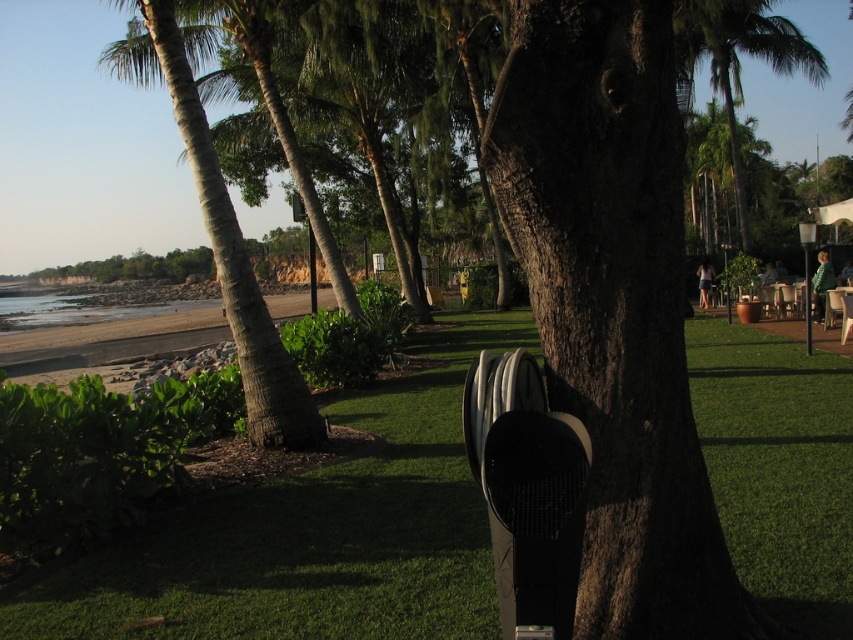
Who is more forward, (828,371) or (733,28)?

Point (828,371)

Does green grass at center appear on the left side of green leafy palm tree at upper right?

Yes, green grass at center is to the left of green leafy palm tree at upper right.

Is point (733, 422) closer to viewer compared to point (776, 70)?

Yes, it is in front of point (776, 70).

I want to click on green grass at center, so click(x=312, y=534).

Which is more to the left, green grass at center or green leafy palm tree at upper center?

green grass at center

Is green grass at center behind green leafy palm tree at upper center?

No.

Which is behind, point (389, 515) or point (734, 168)?

Point (734, 168)

I want to click on green grass at center, so click(x=312, y=534).

Consider the image. Can you confirm if white plastic beach chair at center is taller than green leafy palm tree at upper center?

In fact, white plastic beach chair at center may be shorter than green leafy palm tree at upper center.

Who is more forward, (537, 461) or (711, 118)?

Point (537, 461) is more forward.

At what (x,y) coordinates should I click in order to perform the action: click on white plastic beach chair at center. Please return your answer as a coordinate pair (x, y). This screenshot has width=853, height=640. Looking at the image, I should click on (527, 492).